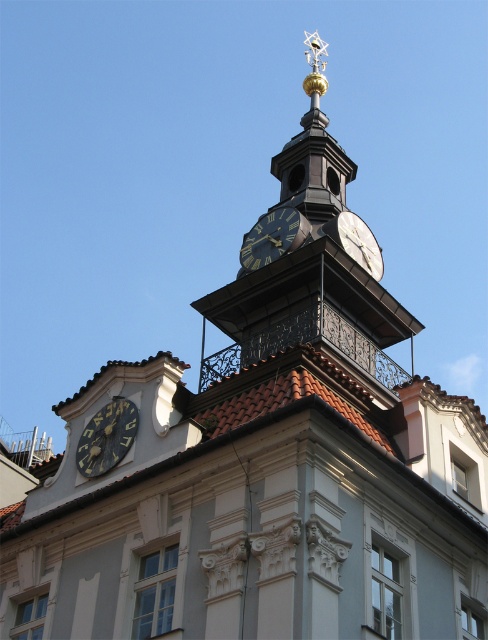
Question: Does dark brown wooden clock at center have a lesser width compared to gold metallic clock at upper center?

Choices:
 (A) no
 (B) yes

Answer: (A)

Question: Which point is farther from the camera taking this photo?

Choices:
 (A) (136, 419)
 (B) (290, 227)
 (C) (377, 252)

Answer: (C)

Question: Does dark brown wooden clock at lower left appear on the right side of dark brown wooden clock at center?

Choices:
 (A) yes
 (B) no

Answer: (B)

Question: Which of the following is the closest to the observer?

Choices:
 (A) dark brown wooden clock at lower left
 (B) dark brown wooden clock at center
 (C) gold metallic clock at upper center

Answer: (A)

Question: In this image, where is dark brown wooden clock at lower left located relative to gold metallic clock at upper center?

Choices:
 (A) right
 (B) left

Answer: (B)

Question: Which object appears closest to the camera in this image?

Choices:
 (A) dark brown wooden clock at lower left
 (B) dark brown wooden clock at center
 (C) gold metallic clock at upper center

Answer: (A)